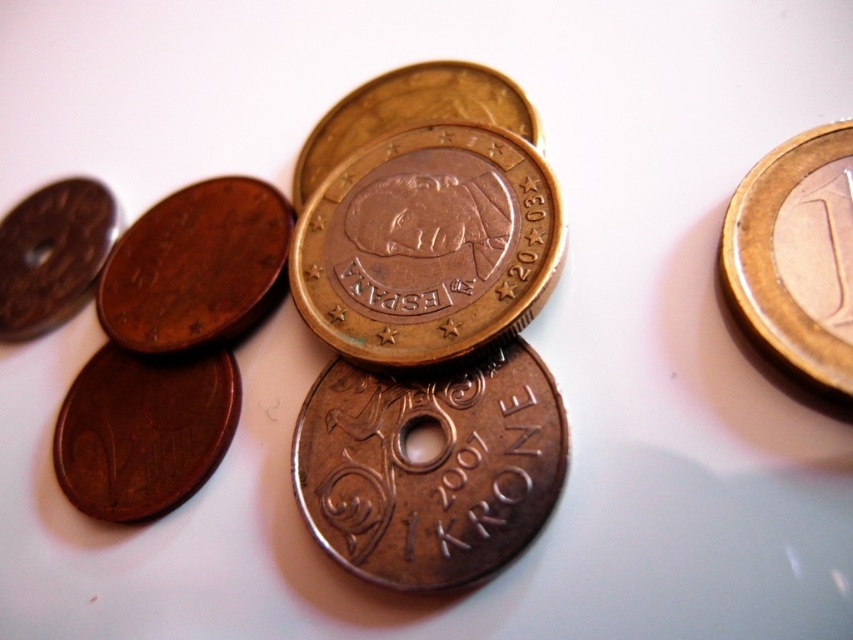
You are a robotic arm trying to pick up two points marked in the image. The first point is at coordinates point [430,316] and the second is at point [115,483]. Since you can only reach one point at a time, which point should you target first to ensure you don t have to move your arm too far afterward?

Point [430,316] is closer to the viewer than point [115,483]. Therefore, you should target point [430,316] first to minimize the distance needed to reach the second point afterward.

You are organizing coins on a table and notice a matte copper coin at center. Is there a coin at the point marked by coordinates (196, 266)?

Yes, there is a matte copper coin at center located at the point marked by coordinates (196, 266).